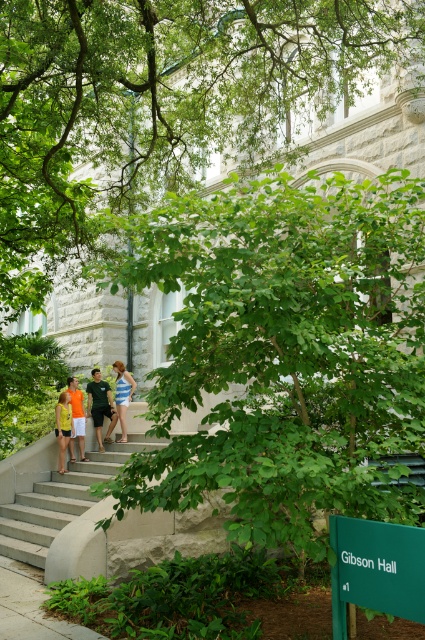
Is green leafy tree at center wider than orange t-shirt at left?

Correct, the width of green leafy tree at center exceeds that of orange t-shirt at left.

From the picture: Does green leafy tree at center have a lesser height compared to orange t-shirt at left?

In fact, green leafy tree at center may be taller than orange t-shirt at left.

Describe the element at coordinates (285, 352) in the screenshot. The width and height of the screenshot is (425, 640). I see `green leafy tree at center` at that location.

This screenshot has height=640, width=425. Find the location of `green leafy tree at center`. green leafy tree at center is located at coordinates (285, 352).

Is light gray concrete stairs at center positioned behind orange t-shirt at center?

No, it is in front of orange t-shirt at center.

How distant is light gray concrete stairs at center from orange t-shirt at center?

They are 1.06 meters apart.

Image resolution: width=425 pixels, height=640 pixels. What do you see at coordinates (96, 520) in the screenshot?
I see `light gray concrete stairs at center` at bounding box center [96, 520].

This screenshot has width=425, height=640. In order to click on light gray concrete stairs at center in this screenshot , I will do `click(96, 520)`.

From the picture: Can you confirm if light gray concrete stairs at center is thinner than orange t-shirt at left?

In fact, light gray concrete stairs at center might be wider than orange t-shirt at left.

Is light gray concrete stairs at center wider than orange t-shirt at left?

Correct, the width of light gray concrete stairs at center exceeds that of orange t-shirt at left.

The width and height of the screenshot is (425, 640). Describe the element at coordinates (96, 520) in the screenshot. I see `light gray concrete stairs at center` at that location.

Where is `light gray concrete stairs at center`? The width and height of the screenshot is (425, 640). light gray concrete stairs at center is located at coordinates (96, 520).